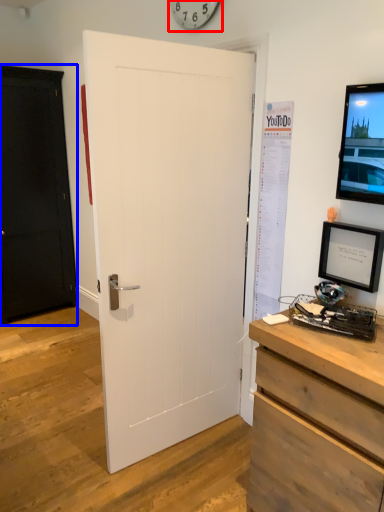
Question: Which point is further to the camera, clock (highlighted by a red box) or door (highlighted by a blue box)?

Choices:
 (A) clock
 (B) door

Answer: (B)